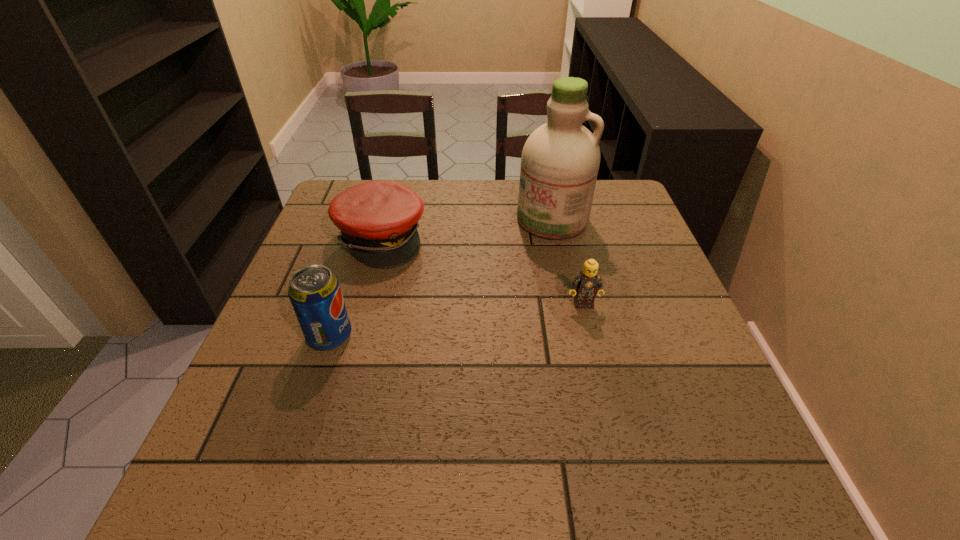
Image resolution: width=960 pixels, height=540 pixels. I want to click on free space located on the front of the cap with an emblem, so click(x=526, y=334).

Where is `blank space located 0.130m on the front of the cap with an emblem`? The height and width of the screenshot is (540, 960). blank space located 0.130m on the front of the cap with an emblem is located at coordinates (446, 282).

The width and height of the screenshot is (960, 540). In order to click on free space located 0.190m on the front of the cap with an emblem in this screenshot , I will do `click(465, 294)`.

Locate an element on the screen. This screenshot has width=960, height=540. cleansing agent located in the far edge section of the desktop is located at coordinates (560, 160).

Where is `cap positioned at the far edge`? The width and height of the screenshot is (960, 540). cap positioned at the far edge is located at coordinates (378, 219).

The width and height of the screenshot is (960, 540). In order to click on soda situated at the left edge in this screenshot , I will do `click(315, 294)`.

What are the coordinates of `cap that is at the left edge` in the screenshot? It's located at (378, 219).

You are a GUI agent. You are given a task and a screenshot of the screen. Output one action in this format:
    pyautogui.click(x=<x>, y=<y>)
    Task: Click on the object at the right edge
    This screenshot has width=960, height=540.
    Given the screenshot: What is the action you would take?
    pyautogui.click(x=560, y=160)

Find the location of a particular element. object that is at the far left corner is located at coordinates (378, 219).

Identify the location of object that is at the far right corner. The width and height of the screenshot is (960, 540). (560, 160).